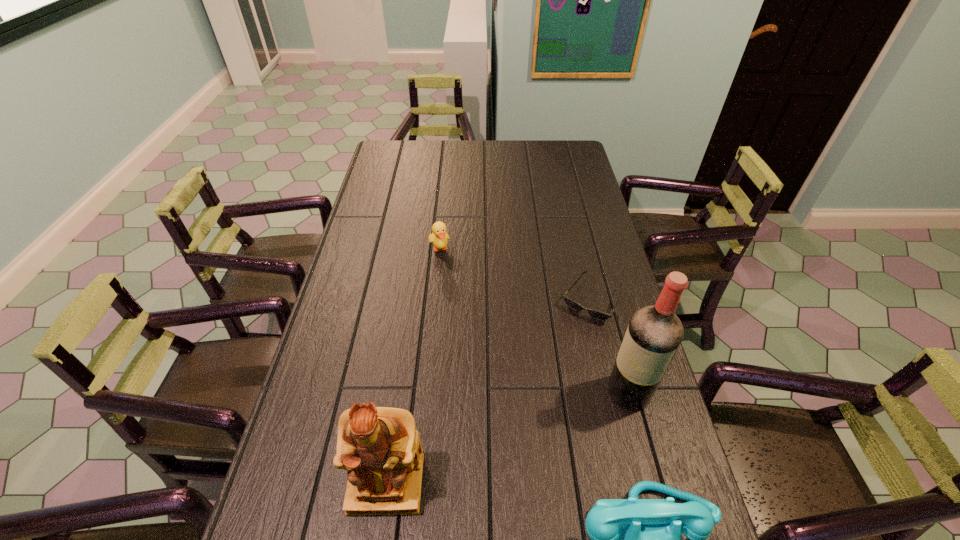
Locate which object ranks second in proximity to the telephone. Please provide its 2D coordinates. Your answer should be formatted as a tuple, i.e. [(x, y)], where the tuple contains the x and y coordinates of a point satisfying the conditions above.

[(380, 447)]

Find the location of a particular element. The height and width of the screenshot is (540, 960). vacant space that satisfies the following two spatial constraints: 1. on the front side of the shortest object; 2. on the left side of the liquor is located at coordinates (613, 392).

I want to click on free space that satisfies the following two spatial constraints: 1. on the front side of the liquor; 2. on the right side of the farthest object, so point(425,392).